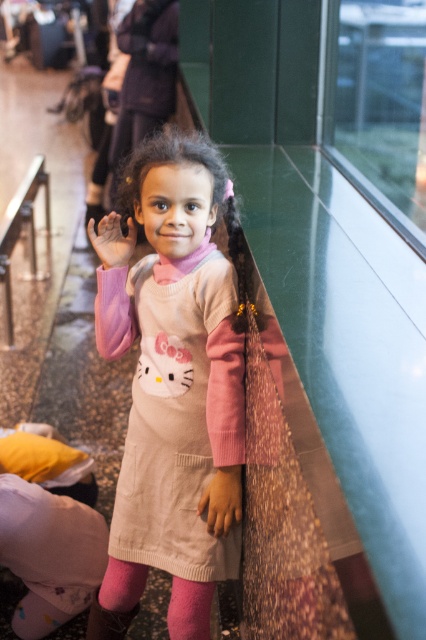
Question: Can you confirm if metallic rail at lower left is smaller than pink fabric hand at center?

Choices:
 (A) no
 (B) yes

Answer: (A)

Question: Among these objects, which one is farthest from the camera?

Choices:
 (A) pink fuzzy sock at lower center
 (B) pink fabric hand at center
 (C) smooth beige hand at center
 (D) metallic rail at lower left

Answer: (D)

Question: Which object appears closest to the camera in this image?

Choices:
 (A) smooth beige hand at center
 (B) metallic rail at lower left
 (C) pink fuzzy sock at lower center
 (D) pink fabric hand at center

Answer: (A)

Question: Is pink fuzzy sock at lower center smaller than pink fabric hand at center?

Choices:
 (A) yes
 (B) no

Answer: (A)

Question: In this image, where is metallic rail at lower left located relative to pink fabric hand at center?

Choices:
 (A) right
 (B) left

Answer: (B)

Question: Considering the real-world distances, which object is farthest from the pink cotton dress at center?

Choices:
 (A) pink fuzzy sock at lower center
 (B) metallic rail at lower left
 (C) smooth beige hand at center
 (D) pink fabric hand at center

Answer: (B)